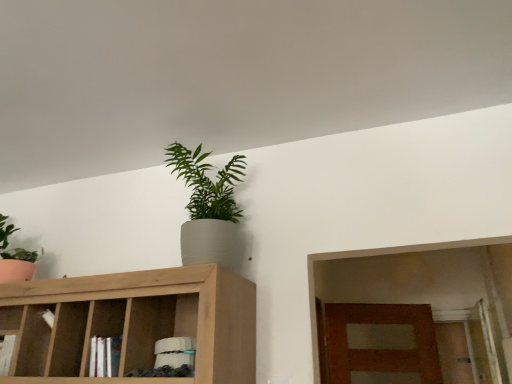
Question: Does green matte plant at upper center, which is counted as the first houseplant, starting from the right, have a smaller size compared to light brown wood cabinet at upper center?

Choices:
 (A) yes
 (B) no

Answer: (A)

Question: From the image's perspective, would you say green matte plant at upper center, which is counted as the first houseplant, starting from the right, is positioned over light brown wood cabinet at upper center?

Choices:
 (A) yes
 (B) no

Answer: (A)

Question: Is green matte plant at upper center, which appears as the second houseplant when viewed from the left, not inside light brown wood cabinet at upper center?

Choices:
 (A) no
 (B) yes

Answer: (B)

Question: Considering the relative sizes of green matte plant at upper center, which is counted as the first houseplant, starting from the right, and light brown wood cabinet at upper center in the image provided, is green matte plant at upper center, which is counted as the first houseplant, starting from the right, taller than light brown wood cabinet at upper center?

Choices:
 (A) no
 (B) yes

Answer: (B)

Question: Is green matte plant at upper center, which appears as the second houseplant when viewed from the left, positioned in front of light brown wood cabinet at upper center?

Choices:
 (A) no
 (B) yes

Answer: (A)

Question: Is matte green plant at left, which is counted as the second houseplant, starting from the right, inside or outside of green matte plant at upper center, which is counted as the first houseplant, starting from the right?

Choices:
 (A) outside
 (B) inside

Answer: (A)

Question: Relative to green matte plant at upper center, which is counted as the first houseplant, starting from the right, is matte green plant at left, the first houseplant when ordered from left to right, in front or behind?

Choices:
 (A) front
 (B) behind

Answer: (B)

Question: Based on their positions, is matte green plant at left, the first houseplant when ordered from left to right, located to the left or right of green matte plant at upper center, which appears as the second houseplant when viewed from the left?

Choices:
 (A) right
 (B) left

Answer: (B)

Question: From a real-world perspective, relative to green matte plant at upper center, which is counted as the first houseplant, starting from the right, is matte green plant at left, the first houseplant when ordered from left to right, vertically above or below?

Choices:
 (A) above
 (B) below

Answer: (A)

Question: From the image's perspective, is light brown wood cabinet at upper center above or below matte green plant at left, which is counted as the second houseplant, starting from the right?

Choices:
 (A) above
 (B) below

Answer: (B)

Question: Considering the positions of light brown wood cabinet at upper center and matte green plant at left, which is counted as the second houseplant, starting from the right, in the image, is light brown wood cabinet at upper center bigger or smaller than matte green plant at left, which is counted as the second houseplant, starting from the right,?

Choices:
 (A) small
 (B) big

Answer: (B)

Question: From a real-world perspective, relative to matte green plant at left, the first houseplant when ordered from left to right, is light brown wood cabinet at upper center vertically above or below?

Choices:
 (A) below
 (B) above

Answer: (A)

Question: Is light brown wood cabinet at upper center situated inside matte green plant at left, which is counted as the second houseplant, starting from the right, or outside?

Choices:
 (A) inside
 (B) outside

Answer: (B)

Question: Do you think green matte plant at upper center, which appears as the second houseplant when viewed from the left, is within light brown wood cabinet at upper center, or outside of it?

Choices:
 (A) outside
 (B) inside

Answer: (A)

Question: Considering the positions of green matte plant at upper center, which appears as the second houseplant when viewed from the left, and light brown wood cabinet at upper center in the image, is green matte plant at upper center, which appears as the second houseplant when viewed from the left, bigger or smaller than light brown wood cabinet at upper center?

Choices:
 (A) small
 (B) big

Answer: (A)